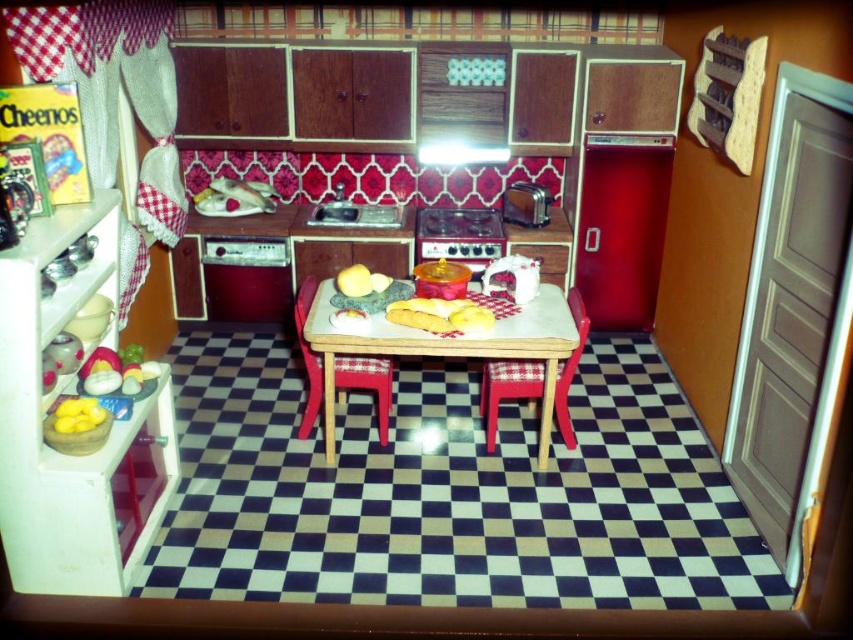
In the miniature kitchen scene, there is a wooden table at center and a red fabric chair at center. Which object takes up more space in the center area?

The wooden table at center is bigger than the red fabric chair at center, so it takes up more space in the center area.

You are a small toy that is 10 inches long. You want to place yourself on the wooden table at center so that you are as far away as possible from the red fabric chair at center. What is the maximum distance you can be from the chair?

The wooden table at center is 13.06 inches away from the red fabric chair at center. Since the toy is 10 inches long, the maximum distance it can be placed from the chair is 13.06 inches minus half the toy length, which is 5 inches. Therefore, the maximum distance is 8.06 inches.